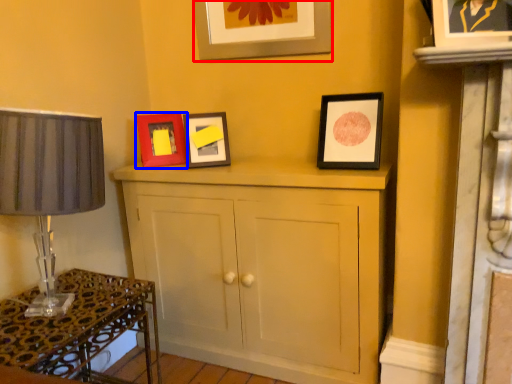
Question: Which point is closer to the camera, picture frame (highlighted by a red box) or picture frame (highlighted by a blue box)?

Choices:
 (A) picture frame
 (B) picture frame

Answer: (A)